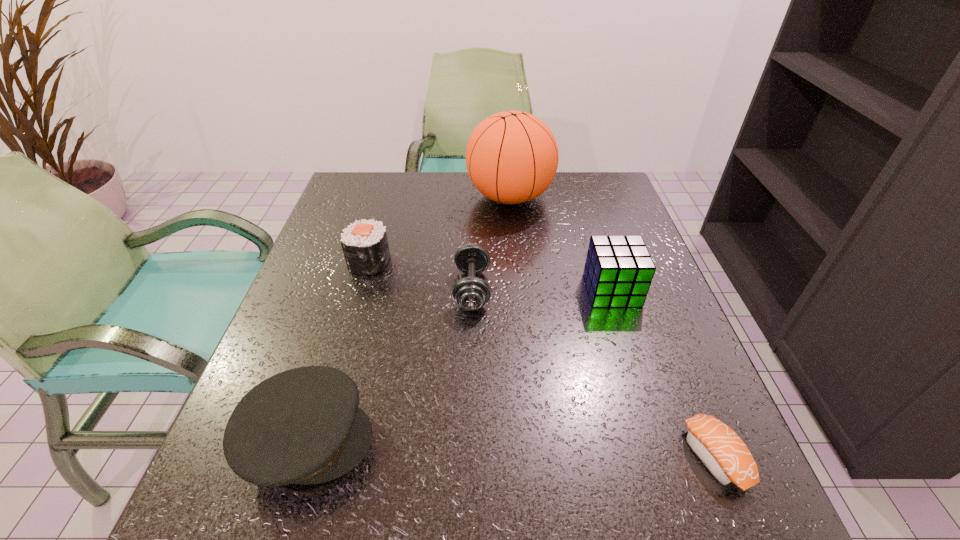
Find the location of a particular element. The height and width of the screenshot is (540, 960). free space that is in between the basketball and the left sushi is located at coordinates (440, 230).

You are a GUI agent. You are given a task and a screenshot of the screen. Output one action in this format:
    pyautogui.click(x=<x>, y=<y>)
    Task: Click on the vacant region between the cube and the tallest object
    Image resolution: width=960 pixels, height=540 pixels.
    Given the screenshot: What is the action you would take?
    pyautogui.click(x=561, y=244)

The width and height of the screenshot is (960, 540). In order to click on empty space between the cube and the beret in this screenshot , I will do click(x=460, y=365).

At what (x,y) coordinates should I click in order to perform the action: click on free point between the second shortest object and the tallest object. Please return your answer as a coordinate pair (x, y). The image size is (960, 540). Looking at the image, I should click on (491, 243).

Where is `free space between the shortest object and the second shortest object`? This screenshot has width=960, height=540. free space between the shortest object and the second shortest object is located at coordinates (593, 373).

The height and width of the screenshot is (540, 960). I want to click on free space between the beret and the second shortest object, so click(x=390, y=364).

Identify the location of free space between the beret and the second shortest object. (390, 364).

The width and height of the screenshot is (960, 540). Identify the location of vacant space in between the dumbbell and the cube. (541, 289).

Locate an element on the screen. This screenshot has width=960, height=540. vacant area that lies between the tallest object and the cube is located at coordinates (561, 244).

Identify the location of the second closest object to the cube. The width and height of the screenshot is (960, 540). click(471, 293).